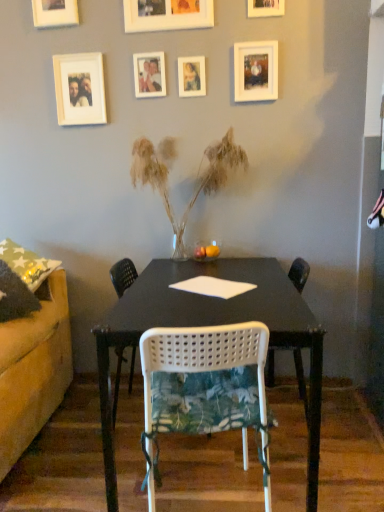
Question: Considering the relative positions of green floral fabric chair at center, which is counted as the second chair, starting from the back, and translucent glass vase with dried grass at center in the image provided, is green floral fabric chair at center, which is counted as the second chair, starting from the back, to the right of translucent glass vase with dried grass at center from the viewer's perspective?

Choices:
 (A) yes
 (B) no

Answer: (A)

Question: Is the position of green floral fabric chair at center, which is the 1th chair from front to back, less distant than that of translucent glass vase with dried grass at center?

Choices:
 (A) no
 (B) yes

Answer: (B)

Question: Is green floral fabric chair at center, which is the 1th chair from front to back, bigger than translucent glass vase with dried grass at center?

Choices:
 (A) yes
 (B) no

Answer: (B)

Question: Can you confirm if green floral fabric chair at center, which is the 1th chair from front to back, is taller than translucent glass vase with dried grass at center?

Choices:
 (A) no
 (B) yes

Answer: (A)

Question: Is green floral fabric chair at center, which is the 1th chair from front to back, not within translucent glass vase with dried grass at center?

Choices:
 (A) no
 (B) yes

Answer: (B)

Question: Can you confirm if green floral fabric chair at center, which is counted as the second chair, starting from the back, is shorter than translucent glass vase with dried grass at center?

Choices:
 (A) no
 (B) yes

Answer: (B)

Question: Does white mesh chair at center, the second chair when ordered from front to back, have a larger size compared to white matte picture frame at upper center, which ranks as the second picture frame in right-to-left order?

Choices:
 (A) yes
 (B) no

Answer: (A)

Question: Is white mesh chair at center, arranged as the 1th chair when viewed from the back, positioned behind white matte picture frame at upper center, which ranks as the second picture frame in right-to-left order?

Choices:
 (A) yes
 (B) no

Answer: (B)

Question: Can you confirm if white mesh chair at center, arranged as the 1th chair when viewed from the back, is taller than white matte picture frame at upper center, which appears as the sixth picture frame when viewed from the left?

Choices:
 (A) yes
 (B) no

Answer: (A)

Question: Does white mesh chair at center, the second chair when ordered from front to back, have a lesser height compared to white matte picture frame at upper center, which appears as the sixth picture frame when viewed from the left?

Choices:
 (A) yes
 (B) no

Answer: (B)

Question: Is white mesh chair at center, the second chair when ordered from front to back, far from white matte picture frame at upper center, which appears as the sixth picture frame when viewed from the left?

Choices:
 (A) yes
 (B) no

Answer: (A)

Question: Is white mesh chair at center, arranged as the 1th chair when viewed from the back, at the right side of white matte picture frame at upper center, which appears as the sixth picture frame when viewed from the left?

Choices:
 (A) no
 (B) yes

Answer: (A)

Question: Are white matte picture frame at upper center, which ranks as the second picture frame in right-to-left order, and translucent glass vase with dried grass at center located far from each other?

Choices:
 (A) yes
 (B) no

Answer: (B)